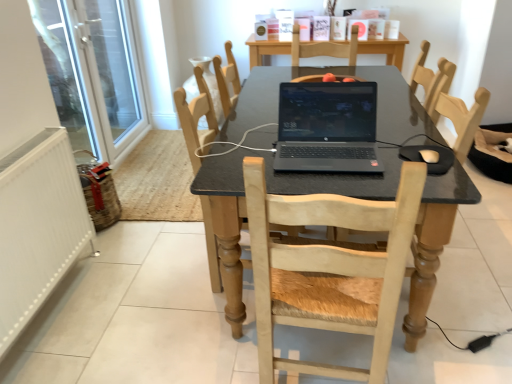
Question: Is white matte mouse at lower right to the left of white glass screen door at left from the viewer's perspective?

Choices:
 (A) yes
 (B) no

Answer: (B)

Question: Does white matte mouse at lower right lie in front of white glass screen door at left?

Choices:
 (A) no
 (B) yes

Answer: (B)

Question: Is white matte mouse at lower right shorter than white glass screen door at left?

Choices:
 (A) yes
 (B) no

Answer: (A)

Question: Considering the relative positions of white matte mouse at lower right and white glass screen door at left in the image provided, is white matte mouse at lower right to the right of white glass screen door at left from the viewer's perspective?

Choices:
 (A) yes
 (B) no

Answer: (A)

Question: Is white matte mouse at lower right taller than white glass screen door at left?

Choices:
 (A) no
 (B) yes

Answer: (A)

Question: Is point (212, 92) closer or farther from the camera than point (24, 269)?

Choices:
 (A) closer
 (B) farther

Answer: (B)

Question: From the image's perspective, relative to white textured radiator at left, is wooden chair at upper center, the 1th chair from the back, above or below?

Choices:
 (A) above
 (B) below

Answer: (A)

Question: Visually, is wooden chair at upper center, the 1th chair from the back, positioned to the left or to the right of white textured radiator at left?

Choices:
 (A) left
 (B) right

Answer: (B)

Question: Is wooden chair at upper center, the 1th chair from the back, bigger or smaller than white textured radiator at left?

Choices:
 (A) small
 (B) big

Answer: (B)

Question: From the image's perspective, relative to light wood chair at center, which ranks as the second chair in front-to-back order, is black matte laptop at center above or below?

Choices:
 (A) above
 (B) below

Answer: (A)

Question: Considering their positions, is black matte laptop at center located in front of or behind light wood chair at center, which is counted as the 2th chair, starting from the back?

Choices:
 (A) front
 (B) behind

Answer: (A)

Question: Is black matte laptop at center to the left or to the right of light wood chair at center, which ranks as the second chair in front-to-back order, in the image?

Choices:
 (A) right
 (B) left

Answer: (A)

Question: From a real-world perspective, is black matte laptop at center positioned above or below light wood chair at center, which ranks as the second chair in front-to-back order?

Choices:
 (A) above
 (B) below

Answer: (A)

Question: From a real-world perspective, is black matte laptop at center positioned above or below white textured radiator at left?

Choices:
 (A) below
 (B) above

Answer: (B)

Question: Looking at their shapes, would you say black matte laptop at center is wider or thinner than white textured radiator at left?

Choices:
 (A) thin
 (B) wide

Answer: (B)